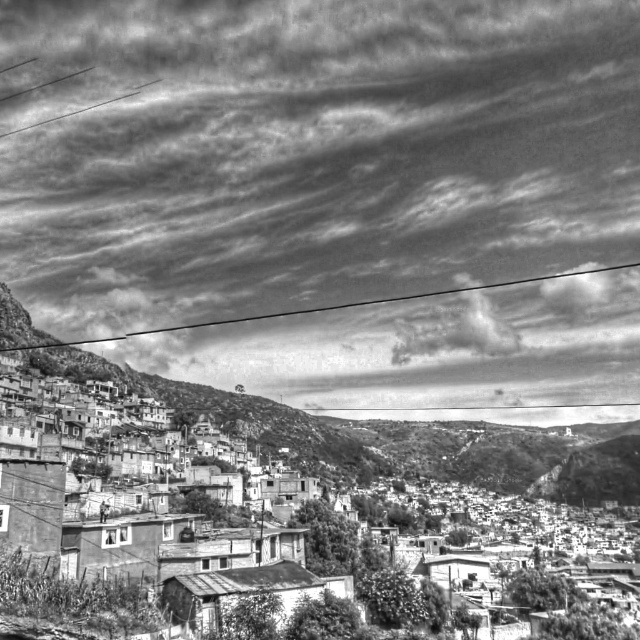
Is grainy concrete houses at lower left wider than black wire at upper center?

No.

Does grainy concrete houses at lower left appear over black wire at upper center?

No, grainy concrete houses at lower left is not above black wire at upper center.

Image resolution: width=640 pixels, height=640 pixels. What do you see at coordinates (417, 451) in the screenshot?
I see `grainy concrete houses at lower left` at bounding box center [417, 451].

Find the location of a particular element. The height and width of the screenshot is (640, 640). grainy concrete houses at lower left is located at coordinates (417, 451).